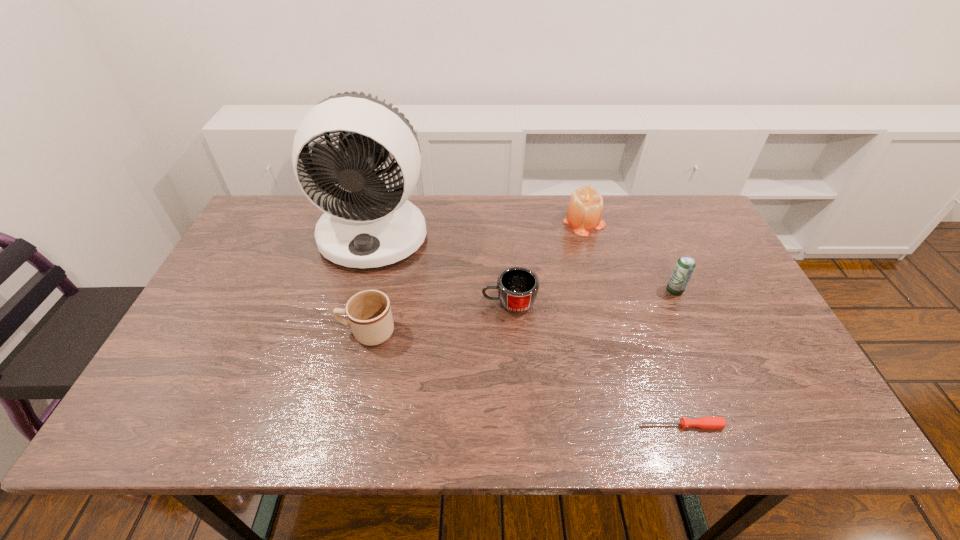
Where is `free space between the right mug and the shortest object`? free space between the right mug and the shortest object is located at coordinates (595, 364).

Locate an element on the screen. free space between the shortest object and the left mug is located at coordinates (524, 379).

Identify the location of vacant space that is in between the shorter mug and the second tallest object. (546, 262).

The width and height of the screenshot is (960, 540). I want to click on free area in between the tallest object and the candle, so click(479, 228).

Image resolution: width=960 pixels, height=540 pixels. I want to click on free space between the taller mug and the shortest object, so click(524, 379).

The image size is (960, 540). I want to click on empty space between the taller mug and the tallest object, so click(x=372, y=284).

Identify which object is located as the nearest to the fifth shortest object. Please provide its 2D coordinates. Your answer should be formatted as a tuple, i.e. [(x, y)], where the tuple contains the x and y coordinates of a point satisfying the conditions above.

[(682, 272)]

Choose which object is the fourth nearest neighbor to the left mug. Please provide its 2D coordinates. Your answer should be formatted as a tuple, i.e. [(x, y)], where the tuple contains the x and y coordinates of a point satisfying the conditions above.

[(703, 422)]

The width and height of the screenshot is (960, 540). Identify the location of free point that satisfies the following two spatial constraints: 1. on the side of the left mug with the handle; 2. on the grille of the fan. (390, 235).

Locate an element on the screen. Image resolution: width=960 pixels, height=540 pixels. vacant point that satisfies the following two spatial constraints: 1. on the side of the taller mug with the handle; 2. on the grille of the fan is located at coordinates (390, 235).